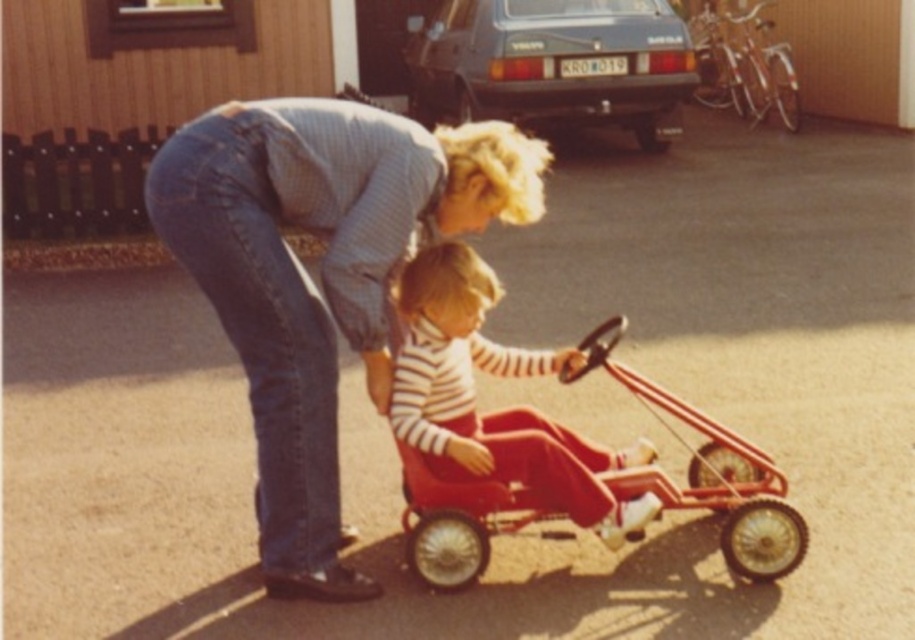
Does matte black car at upper center have a smaller size compared to metallic red toy car at center?

No, matte black car at upper center is not smaller than metallic red toy car at center.

Can you confirm if matte black car at upper center is positioned to the left of metallic red toy car at center?

Indeed, matte black car at upper center is positioned on the left side of metallic red toy car at center.

Find the location of a particular element. matte black car at upper center is located at coordinates (553, 65).

Where is `matte black car at upper center`? matte black car at upper center is located at coordinates pos(553,65).

Is denim jeans at center thinner than striped fabric toddler at center?

Incorrect, denim jeans at center's width is not less than striped fabric toddler at center's.

Does denim jeans at center have a greater width compared to striped fabric toddler at center?

Indeed, denim jeans at center has a greater width compared to striped fabric toddler at center.

Is point (289, 221) farther from viewer compared to point (450, 344)?

That is False.

I want to click on denim jeans at center, so click(321, 276).

Can you confirm if denim jeans at center is positioned to the left of metallic red toy car at center?

Correct, you'll find denim jeans at center to the left of metallic red toy car at center.

Does point (295, 403) lie in front of point (420, 540)?

Yes.

I want to click on denim jeans at center, so tap(321, 276).